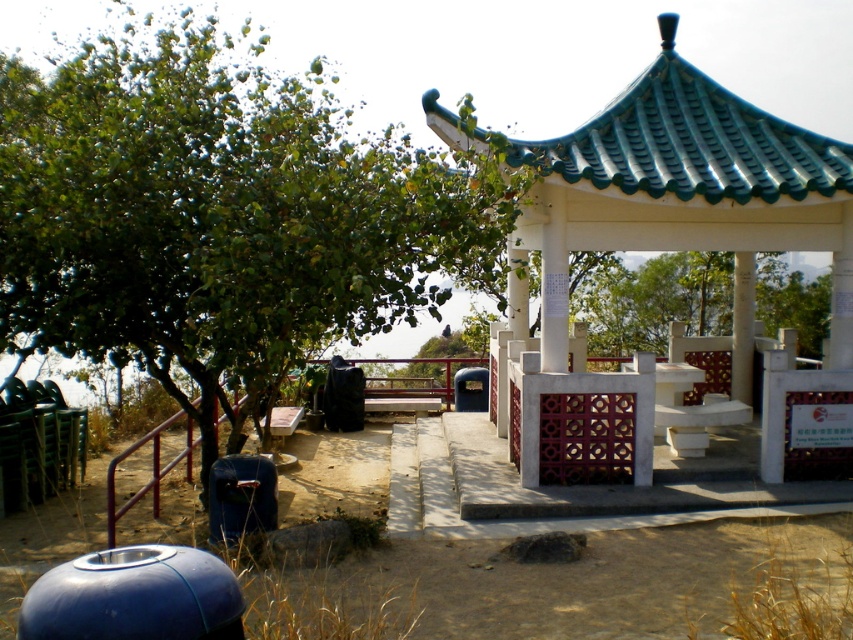
Question: Is green leafy tree at upper left bigger than white glossy pavilion at center?

Choices:
 (A) no
 (B) yes

Answer: (B)

Question: Does green leafy tree at upper left have a larger size compared to white glossy pavilion at center?

Choices:
 (A) yes
 (B) no

Answer: (A)

Question: Which of the following is the farthest from the observer?

Choices:
 (A) green leafy tree at upper left
 (B) white glossy pavilion at center

Answer: (B)

Question: Which of the following is the farthest from the observer?

Choices:
 (A) white glossy pavilion at center
 (B) green leafy tree at upper left

Answer: (A)

Question: Can you confirm if green leafy tree at upper left is positioned to the right of white glossy pavilion at center?

Choices:
 (A) no
 (B) yes

Answer: (A)